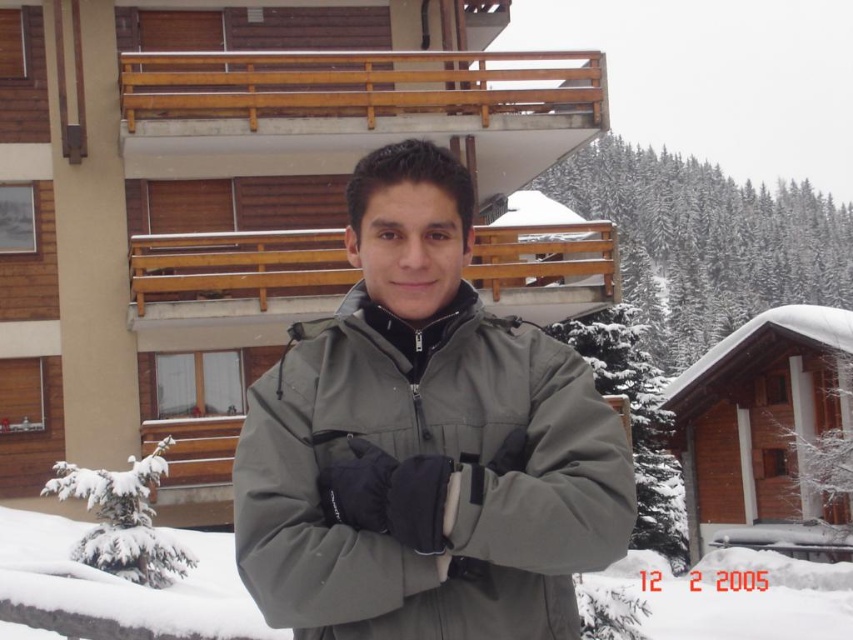
You are standing at the point marked as point (350, 556) in the image. You want to walk straight ahead to the wooden building with a light brown facade. How far will you have to walk to reach the wooden building?

The distance between point (350, 556) and the viewer is 3.97 meters. Since you are standing at point (350, 556), you would need to walk 3.97 meters straight ahead to reach the wooden building with a light brown facade.

You are a photographer trying to capture the person in the gray synthetic jacket at center and the white fluffy snow at center. Since you want to ensure both are in focus, which object should you focus on first to maintain sharpness given their positions?

The gray synthetic jacket at center is located above white fluffy snow at center, so you should focus on the gray synthetic jacket at center first as it is closer to the camera.